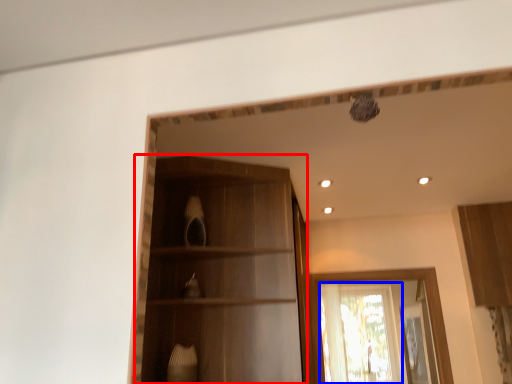
Question: Which object appears closest to the camera in this image, cabinetry (highlighted by a red box) or window (highlighted by a blue box)?

Choices:
 (A) cabinetry
 (B) window

Answer: (A)